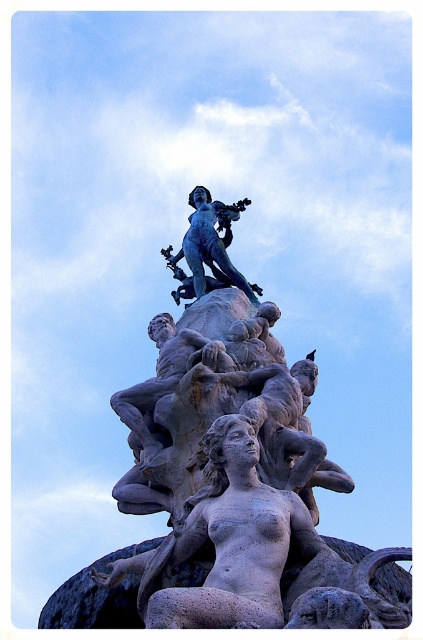
You are an art curator planning to move the smooth gray statue at center and the blue patina statue at upper center to a new exhibition space. The new space has a limited area. Which statue should you prioritize moving first to ensure it fits in the available space?

The smooth gray statue at center occupies less space than the blue patina statue at upper center, so you should prioritize moving the blue patina statue at upper center first to ensure it fits in the available space.